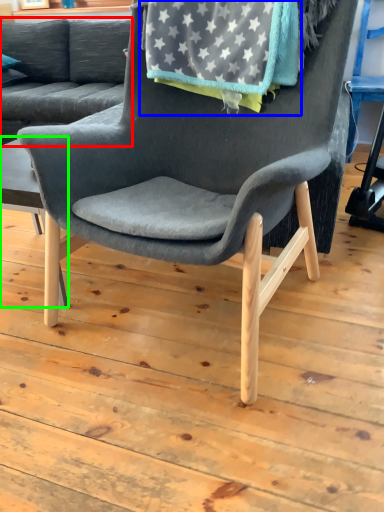
Question: Which object is positioned farthest from studio couch (highlighted by a red box)? Select from blanket (highlighted by a blue box) and table (highlighted by a green box).

Choices:
 (A) blanket
 (B) table

Answer: (A)